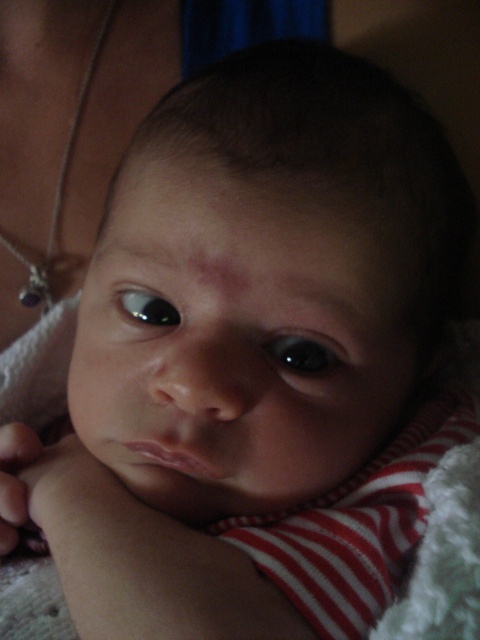
Is point (336, 368) positioned behind point (121, 292)?

No, it is in front of (121, 292).

Is point (310, 337) positioned before point (152, 314)?

Yes, point (310, 337) is closer to viewer.

Where is `black glossy eye at center`? The height and width of the screenshot is (640, 480). black glossy eye at center is located at coordinates (303, 353).